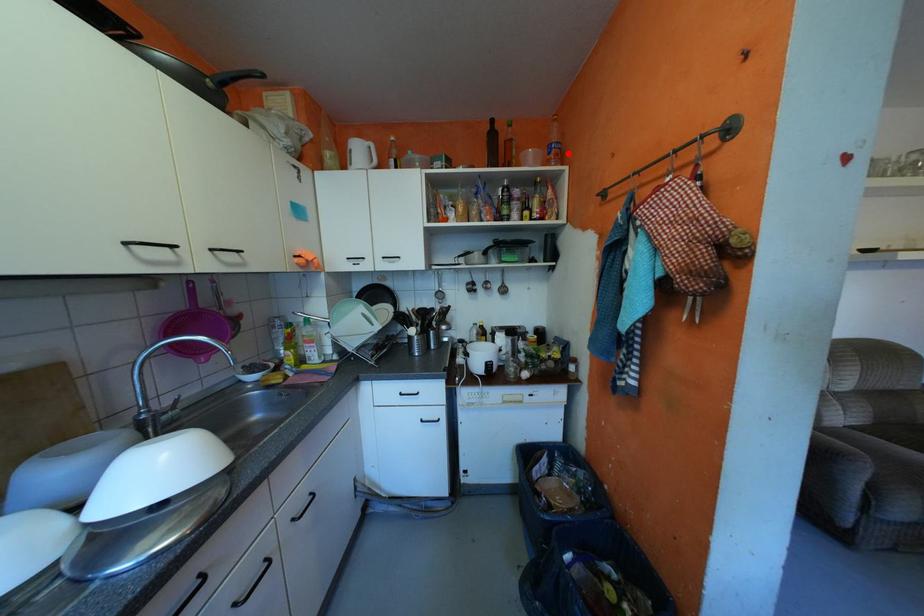
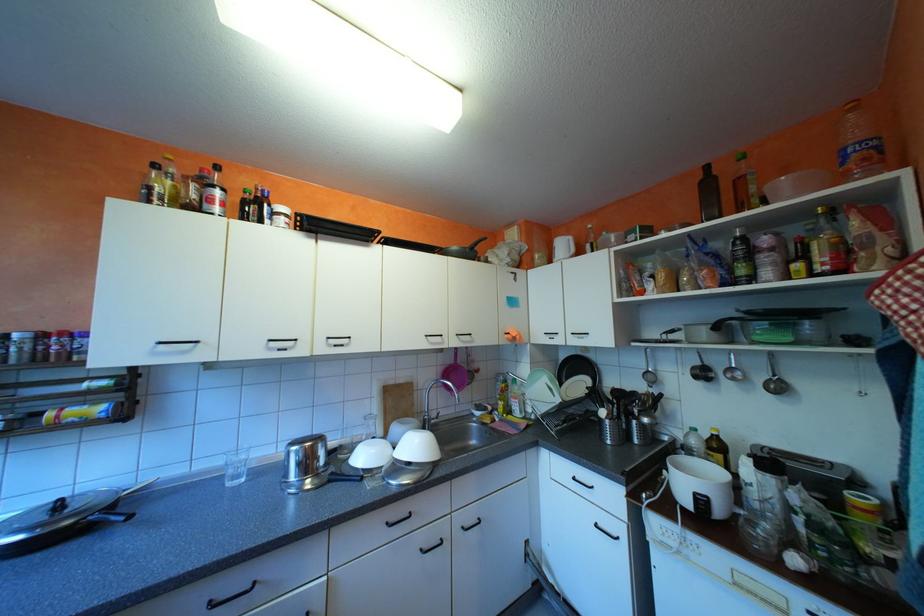
Find the pixel in the second image that matches the highlighted location in the first image.

(877, 159)